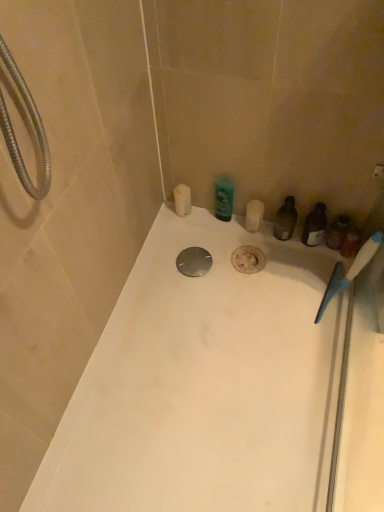
I want to click on vacant point to the left of blue plastic toothbrush at right, so click(285, 303).